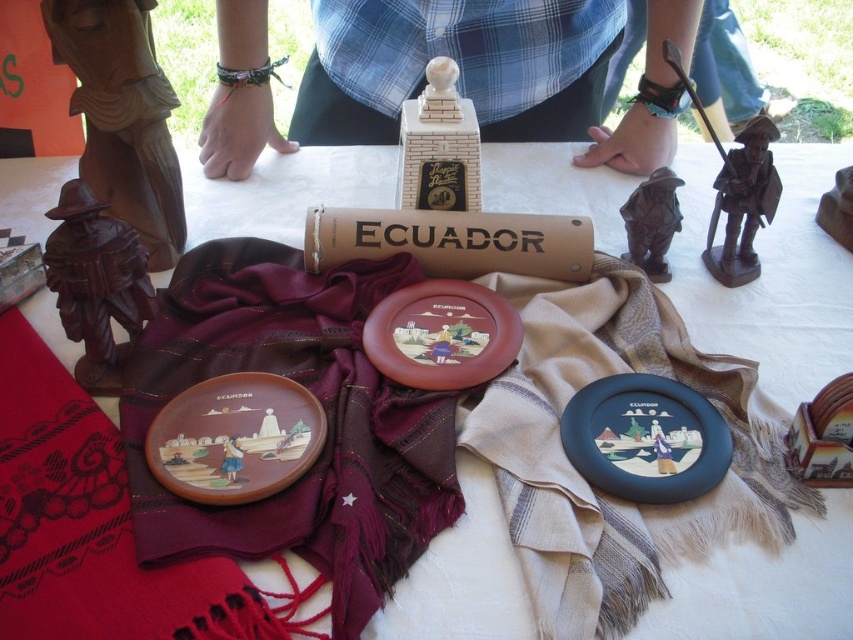
Does point (430, 525) come in front of point (654, 282)?

Yes.

What do you see at coordinates (325, 413) in the screenshot? I see `burgundy fabric at center` at bounding box center [325, 413].

Locate an element on the screen. The height and width of the screenshot is (640, 853). burgundy fabric at center is located at coordinates (325, 413).

Can you confirm if burgundy fabric at center is positioned below matte brown platter at center?

Correct, burgundy fabric at center is located below matte brown platter at center.

Between burgundy fabric at center and matte brown platter at center, which one is positioned lower?

burgundy fabric at center is lower down.

Is point (286, 308) positioned behind point (461, 324)?

Yes.

I want to click on burgundy fabric at center, so click(x=325, y=413).

Can you confirm if blue plaid shirt at center is positioned below matte brown plate at center?

Incorrect, blue plaid shirt at center is not positioned below matte brown plate at center.

Between blue plaid shirt at center and matte brown plate at center, which one is positioned lower?

matte brown plate at center is below.

Where is `blue plaid shirt at center`? The width and height of the screenshot is (853, 640). blue plaid shirt at center is located at coordinates (238, 131).